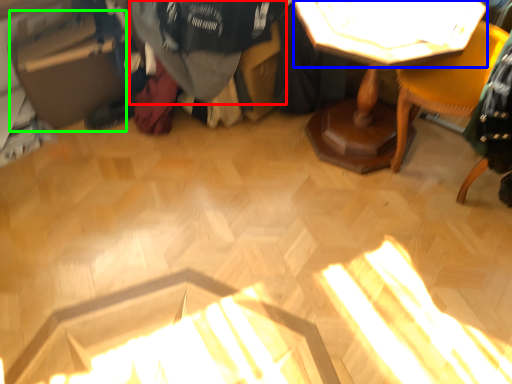
Question: Which is nearer to the clothing (highlighted by a red box)? table top (highlighted by a blue box) or cardboard box (highlighted by a green box).

Choices:
 (A) table top
 (B) cardboard box

Answer: (A)